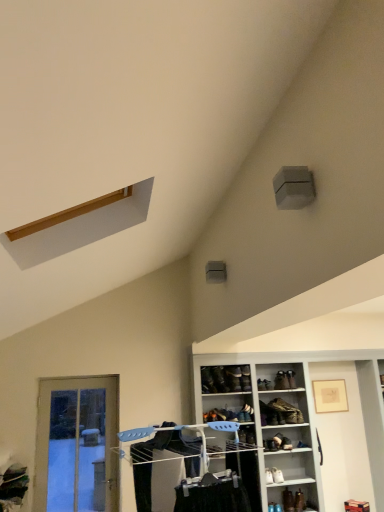
Question: Is leather shoe at center, the fifth shoe in the top-to-bottom sequence, surrounding translucent glass door at lower left?

Choices:
 (A) no
 (B) yes

Answer: (A)

Question: Does leather shoe at center, the fifth shoe in the top-to-bottom sequence, have a greater width compared to translucent glass door at lower left?

Choices:
 (A) no
 (B) yes

Answer: (B)

Question: Considering the relative sizes of leather shoe at center, the fifth shoe in the top-to-bottom sequence, and translucent glass door at lower left in the image provided, is leather shoe at center, the fifth shoe in the top-to-bottom sequence, shorter than translucent glass door at lower left?

Choices:
 (A) no
 (B) yes

Answer: (B)

Question: From a real-world perspective, is leather shoe at center, placed as the fifth shoe when sorted from bottom to top, over translucent glass door at lower left?

Choices:
 (A) yes
 (B) no

Answer: (A)

Question: From the image's perspective, is leather shoe at center, placed as the fifth shoe when sorted from bottom to top, beneath translucent glass door at lower left?

Choices:
 (A) no
 (B) yes

Answer: (A)

Question: Does point (99, 455) appear closer or farther from the camera than point (221, 417)?

Choices:
 (A) farther
 (B) closer

Answer: (A)

Question: Is translucent glass door at lower left bigger or smaller than leather shoe at center, the fifth shoe in the top-to-bottom sequence?

Choices:
 (A) small
 (B) big

Answer: (B)

Question: From the image's perspective, relative to leather shoe at center, the fifth shoe in the top-to-bottom sequence, is translucent glass door at lower left above or below?

Choices:
 (A) above
 (B) below

Answer: (B)

Question: Is translucent glass door at lower left inside the boundaries of leather shoe at center, the fifth shoe in the top-to-bottom sequence, or outside?

Choices:
 (A) inside
 (B) outside

Answer: (B)

Question: Is point (276, 479) closer or farther from the camera than point (241, 386)?

Choices:
 (A) farther
 (B) closer

Answer: (B)

Question: In the image, is white leather shoe at lower center, the 3th shoe when ordered from bottom to top, positioned in front of or behind leather shoe at center, placed as the 2th shoe when sorted from top to bottom?

Choices:
 (A) front
 (B) behind

Answer: (A)

Question: Choose the correct answer: Is white leather shoe at lower center, the 7th shoe when ordered from top to bottom, inside leather shoe at center, placed as the 2th shoe when sorted from top to bottom, or outside it?

Choices:
 (A) inside
 (B) outside

Answer: (B)

Question: From a real-world perspective, relative to leather shoe at center, which is the 8th shoe from bottom to top, is white leather shoe at lower center, the 3th shoe when ordered from bottom to top, vertically above or below?

Choices:
 (A) below
 (B) above

Answer: (A)

Question: Which is correct: leather shoe at center, the 7th shoe when ordered from bottom to top, is inside white leather shoe at lower center, the 3th shoe when ordered from bottom to top, or outside of it?

Choices:
 (A) outside
 (B) inside

Answer: (A)

Question: Visually, is leather shoe at center, the 7th shoe when ordered from bottom to top, positioned to the left or to the right of white leather shoe at lower center, the 7th shoe when ordered from top to bottom?

Choices:
 (A) left
 (B) right

Answer: (A)